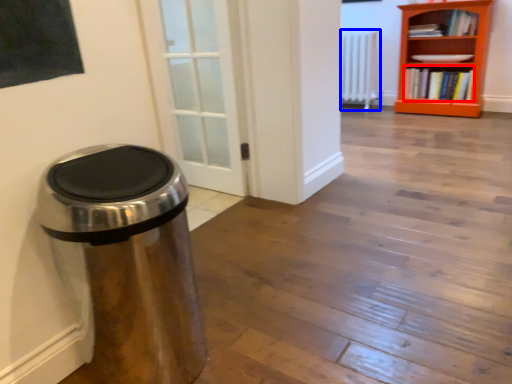
Question: Among these objects, which one is farthest to the camera, book (highlighted by a red box) or radiator (highlighted by a blue box)?

Choices:
 (A) book
 (B) radiator

Answer: (B)